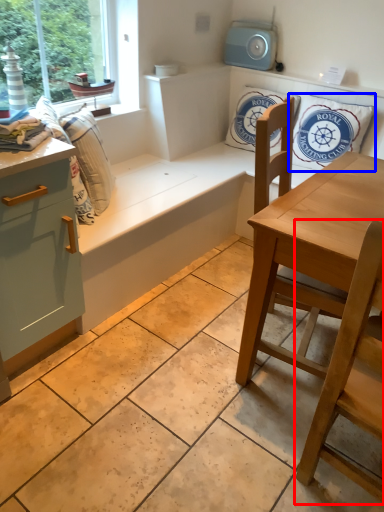
Question: Which object is further to the camera taking this photo, chair (highlighted by a red box) or pillow (highlighted by a blue box)?

Choices:
 (A) chair
 (B) pillow

Answer: (B)